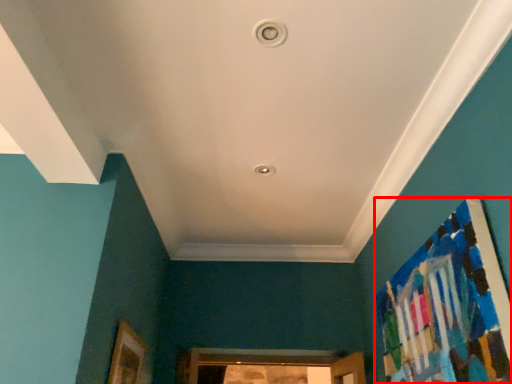
Question: Where is bulletin board (annotated by the red box) located in relation to picture frame in the image?

Choices:
 (A) left
 (B) right

Answer: (B)